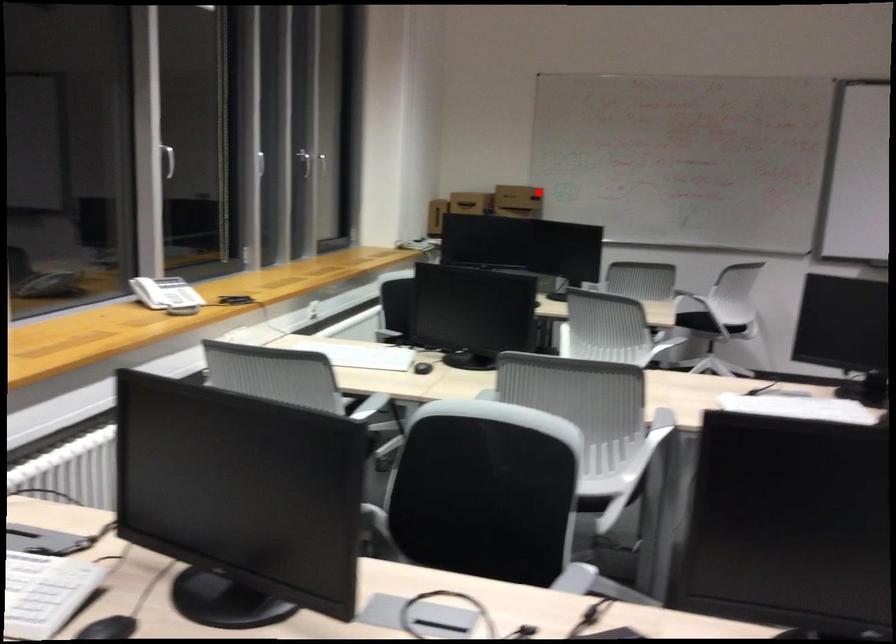
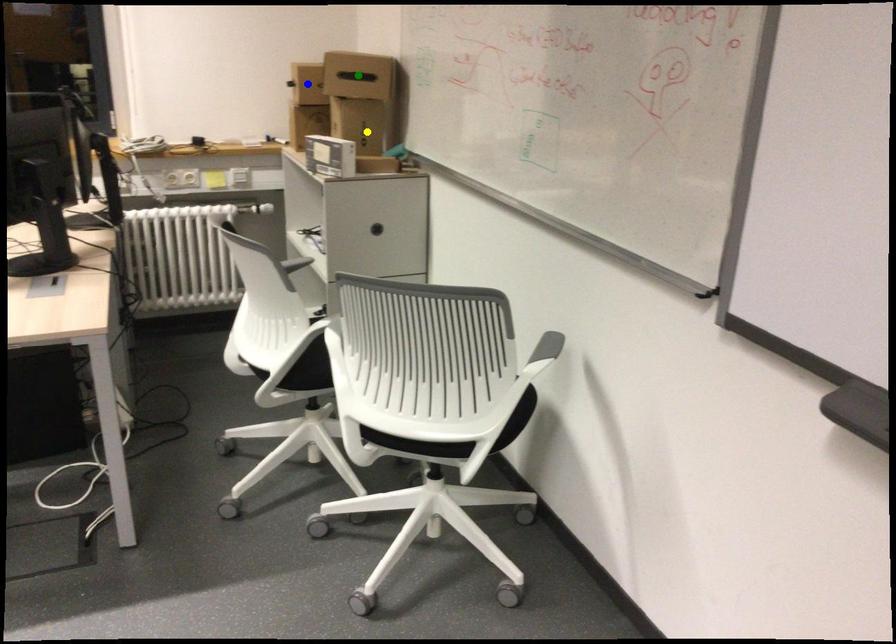
Question: I am providing you with two images of the same scene from different viewpoints. A red point is marked on the first image. You are given multiple points on the second image. Can you choose the point in image 2 that corresponds to the point in image 1?

Choices:
 (A) green point
 (B) yellow point
 (C) blue point

Answer: (A)